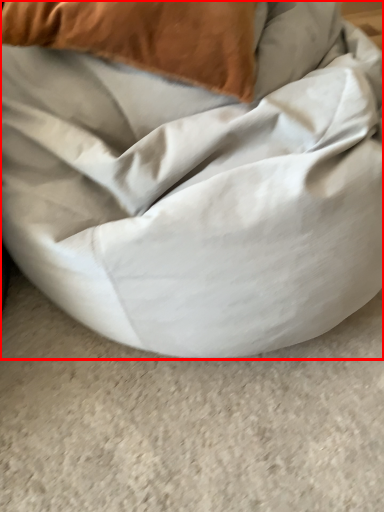
Question: Considering the relative positions of furniture (annotated by the red box) and pillow in the image provided, where is furniture (annotated by the red box) located with respect to the staircase?

Choices:
 (A) right
 (B) left

Answer: (A)